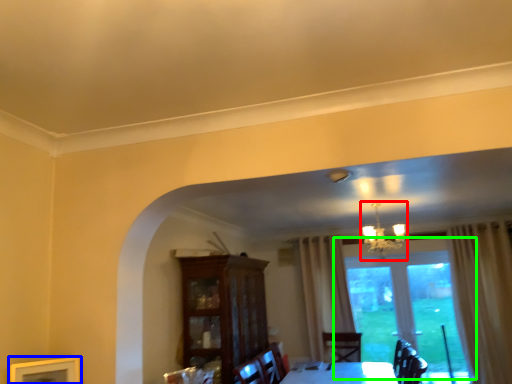
Question: Which object is positioned closest to light fixture (highlighted by a red box)? Select from picture frame (highlighted by a blue box) and window (highlighted by a green box).

Choices:
 (A) picture frame
 (B) window

Answer: (B)